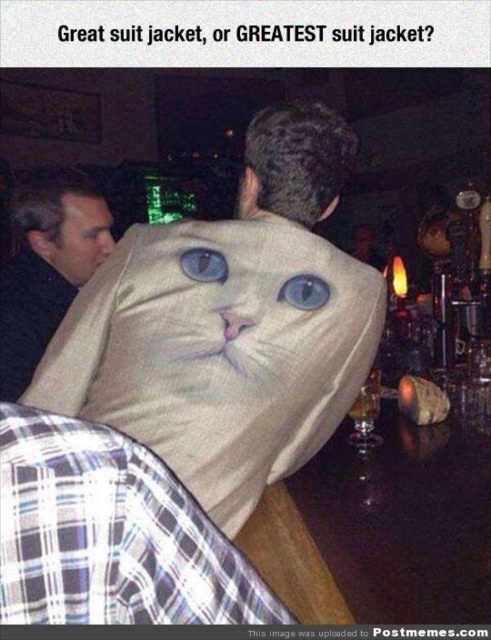
This screenshot has height=640, width=491. Identify the location of beige fabric cat at center. (218, 349).

The width and height of the screenshot is (491, 640). In order to click on beige fabric cat at center in this screenshot , I will do `click(218, 349)`.

Who is positioned more to the right, matte black jacket at upper left or matte skin face at upper left?

From the viewer's perspective, matte skin face at upper left appears more on the right side.

Does matte black jacket at upper left have a lesser width compared to matte skin face at upper left?

In fact, matte black jacket at upper left might be wider than matte skin face at upper left.

Which is in front, point (2, 326) or point (81, 250)?

Point (2, 326)

Identify the location of matte black jacket at upper left. The width and height of the screenshot is (491, 640). tap(47, 266).

Between point (224, 225) and point (84, 225), which one is positioned in front?

Point (224, 225) is in front.

Identify the location of beige fabric cat at center. (218, 349).

I want to click on beige fabric cat at center, so pos(218,349).